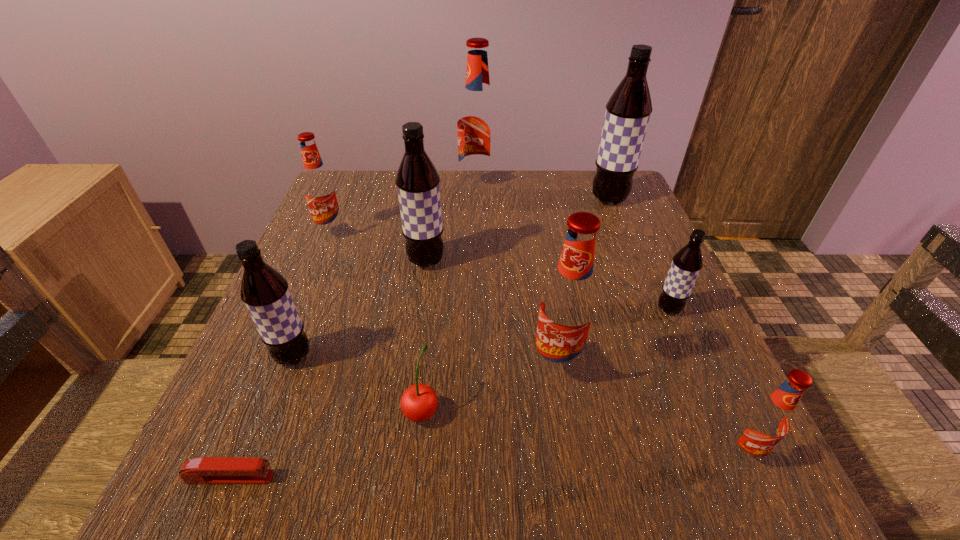
Where is `the leftmost brown root beer`? the leftmost brown root beer is located at coordinates (265, 292).

Where is `the smallest brown root beer`? The height and width of the screenshot is (540, 960). the smallest brown root beer is located at coordinates (687, 263).

Image resolution: width=960 pixels, height=540 pixels. In order to click on the third farthest brown root beer in this screenshot , I will do `click(687, 263)`.

You are a GUI agent. You are given a task and a screenshot of the screen. Output one action in this format:
    pyautogui.click(x=<x>, y=<y>)
    Task: Click on the rightmost red root beer
    The image size is (960, 540).
    Given the screenshot: What is the action you would take?
    pyautogui.click(x=766, y=422)

Locate an element on the screen. the second nearest object is located at coordinates (766, 422).

You are a GUI agent. You are given a task and a screenshot of the screen. Output one action in this format:
    pyautogui.click(x=<x>, y=<y>)
    Task: Click on the ninth tallest object
    
    Given the screenshot: What is the action you would take?
    pyautogui.click(x=419, y=402)

What are the coordinates of `red cherry` in the screenshot? It's located at (419, 402).

You are a GUI agent. You are given a task and a screenshot of the screen. Output one action in this format:
    pyautogui.click(x=<x>, y=<y>)
    Task: Click on the red stapler
    
    Given the screenshot: What is the action you would take?
    pyautogui.click(x=205, y=470)

Find the location of a particular element. Image resolution: width=960 pixels, height=540 pixels. the nearest object is located at coordinates point(205,470).

Find the location of `vacant space located 0.330m on the front of the third red root beer from right to left`. vacant space located 0.330m on the front of the third red root beer from right to left is located at coordinates (477, 285).